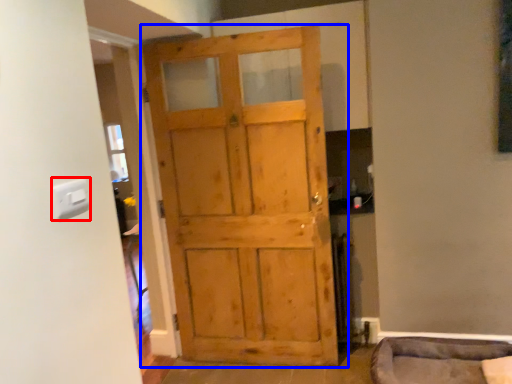
Question: Which of the following is the closest to the observer, light switch (highlighted by a red box) or door (highlighted by a blue box)?

Choices:
 (A) light switch
 (B) door

Answer: (A)